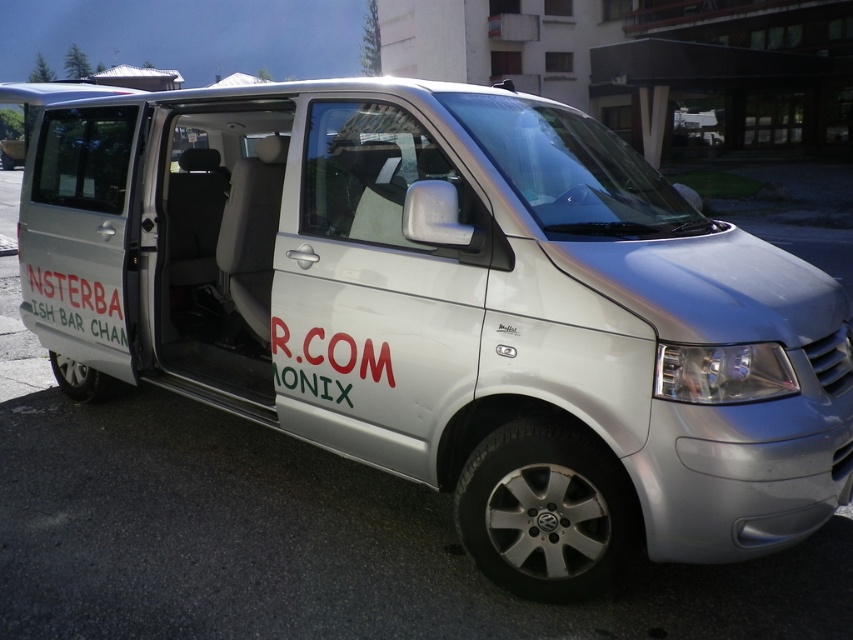
Is white matte door at center bigger than white painted text at side?

Correct, white matte door at center is larger in size than white painted text at side.

What do you see at coordinates (212, 248) in the screenshot?
I see `white matte door at center` at bounding box center [212, 248].

Image resolution: width=853 pixels, height=640 pixels. Find the location of `white matte door at center`. white matte door at center is located at coordinates (212, 248).

Between white matte door at center and red matte text at center, which one is positioned lower?

red matte text at center is lower down.

Is white matte door at center to the right of red matte text at center from the viewer's perspective?

No, white matte door at center is not to the right of red matte text at center.

The height and width of the screenshot is (640, 853). What do you see at coordinates (212, 248) in the screenshot? I see `white matte door at center` at bounding box center [212, 248].

Locate an element on the screen. The height and width of the screenshot is (640, 853). white matte door at center is located at coordinates (212, 248).

Is white painted text at side to the left of red matte text at center from the viewer's perspective?

Correct, you'll find white painted text at side to the left of red matte text at center.

Who is more forward, (96, 291) or (390, 372)?

Point (390, 372) is more forward.

The height and width of the screenshot is (640, 853). What are the coordinates of `white painted text at side` in the screenshot? It's located at (74, 304).